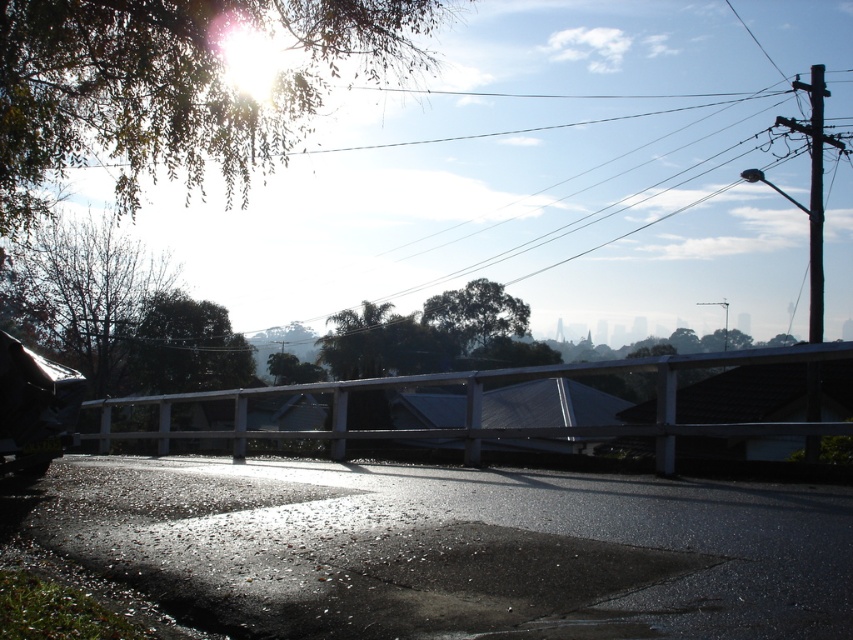
You are a gardener who needs to water both the green leafy tree at upper left and the brown leafy tree at left. Your watering hose is 8 meters long. Starting from where you are standing, can you reach both trees without moving the hose nozzle?

The green leafy tree at upper left is 8.41 meters away from the brown leafy tree at left. Since the distance between them is greater than the 8 meters hose length, you cannot reach both trees without moving the hose nozzle.

You are a photographer wanting to capture the reflection of the trees in the puddles on the road. Which tree, the green leafy tree at upper left or the brown leafy tree at left, would have its reflection more clearly visible in the puddles?

The green leafy tree at upper left might have a more clearly visible reflection in the puddles since it is wider than the brown leafy tree at left, making its reflection larger and more distinct.

You are a delivery person who needs to deliver a package to a house located near the white wooden rail at center. The green leafy tree at upper left is blocking the path. Can you walk around it to reach the rail?

The distance between the green leafy tree at upper left and the white wooden rail at center is 43.43 feet, so yes, you can walk around the tree to reach the rail as there is enough space between them.